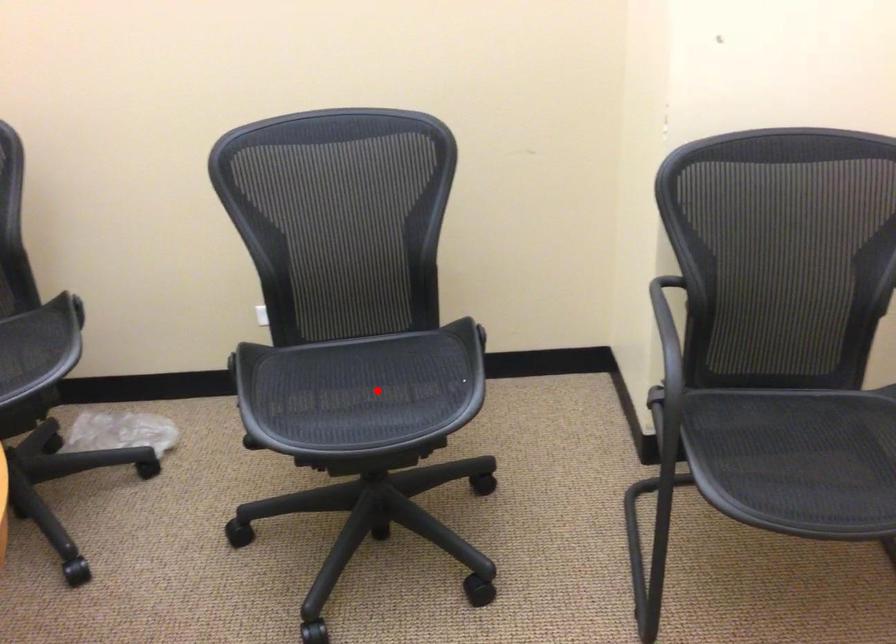
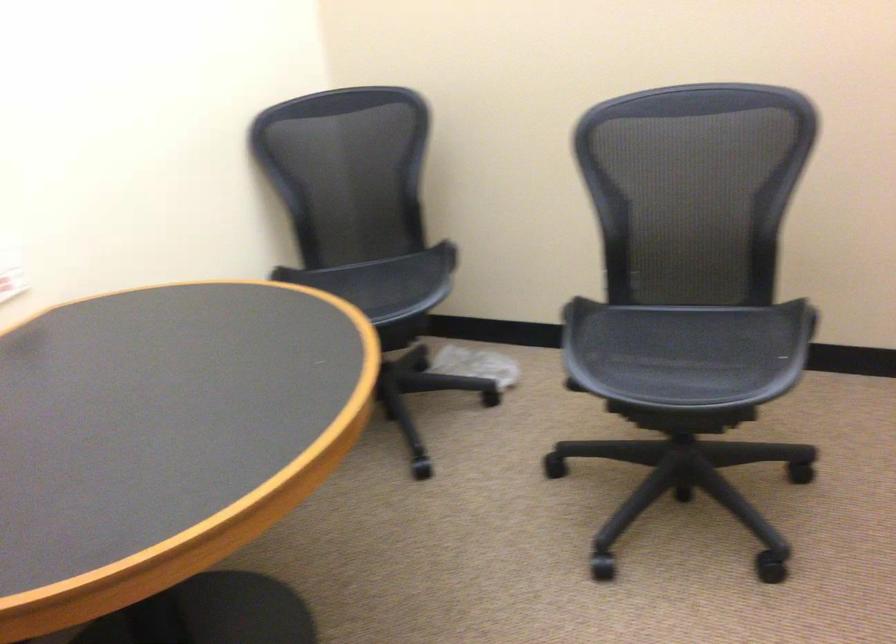
Where in the second image is the point corresponding to the highlighted location from the first image?

(686, 352)